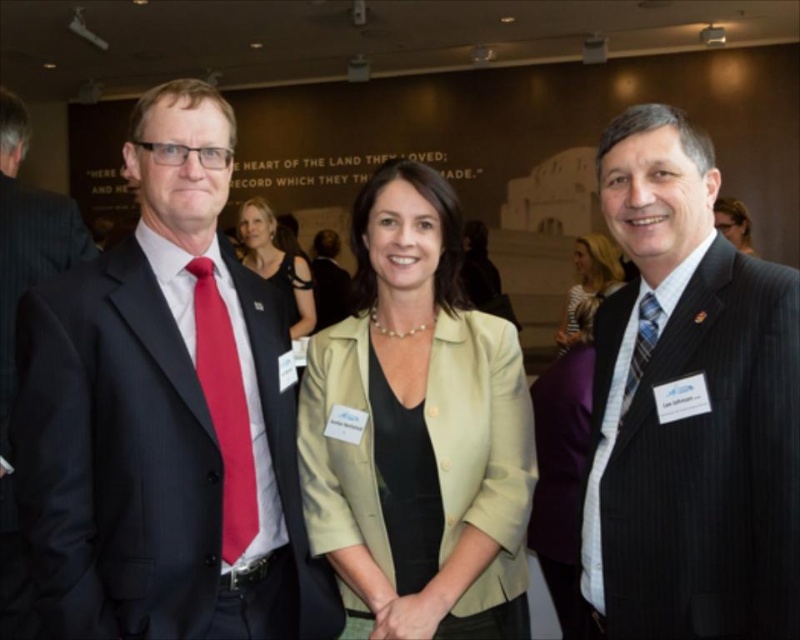
Question: Observing the image, what is the correct spatial positioning of matte red tie at left in reference to matte black jacket at center?

Choices:
 (A) right
 (B) left

Answer: (B)

Question: Which of these objects is positioned closest to the striped suit at right?

Choices:
 (A) blue striped tie at right
 (B) matte purple blazer at center
 (C) matte red tie at left
 (D) matte black blazer at center

Answer: (A)

Question: Which object is closer to the camera taking this photo?

Choices:
 (A) matte purple blazer at center
 (B) matte red tie at left
 (C) black satin dress at center
 (D) dark blue suit at left

Answer: (B)

Question: Does matte black blazer at center have a lesser width compared to matte black jacket at center?

Choices:
 (A) yes
 (B) no

Answer: (A)

Question: Does matte black blazer at center appear on the right side of matte black suit at center?

Choices:
 (A) no
 (B) yes

Answer: (B)

Question: Which of the following is the farthest from the observer?

Choices:
 (A) matte beige blazer at center
 (B) matte red tie at left

Answer: (A)